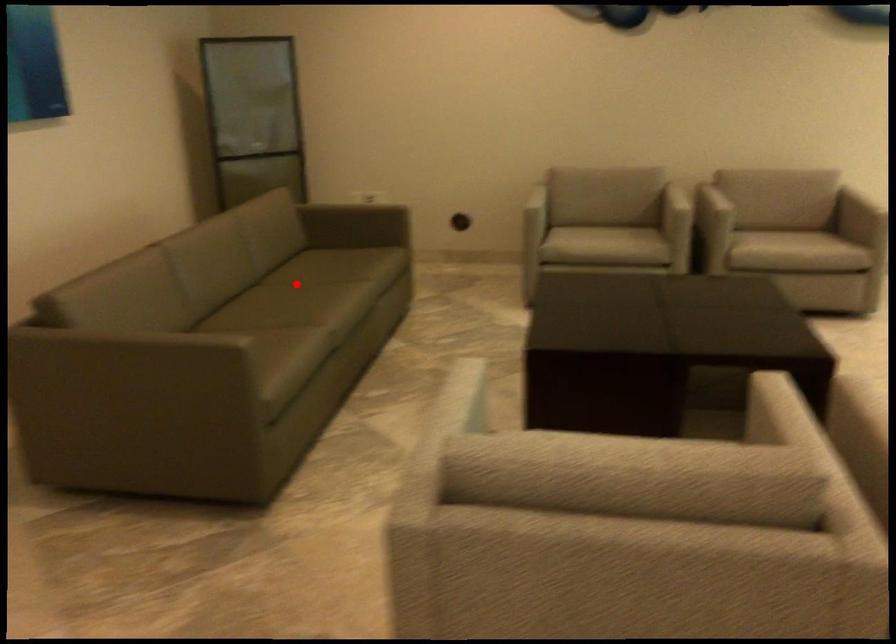
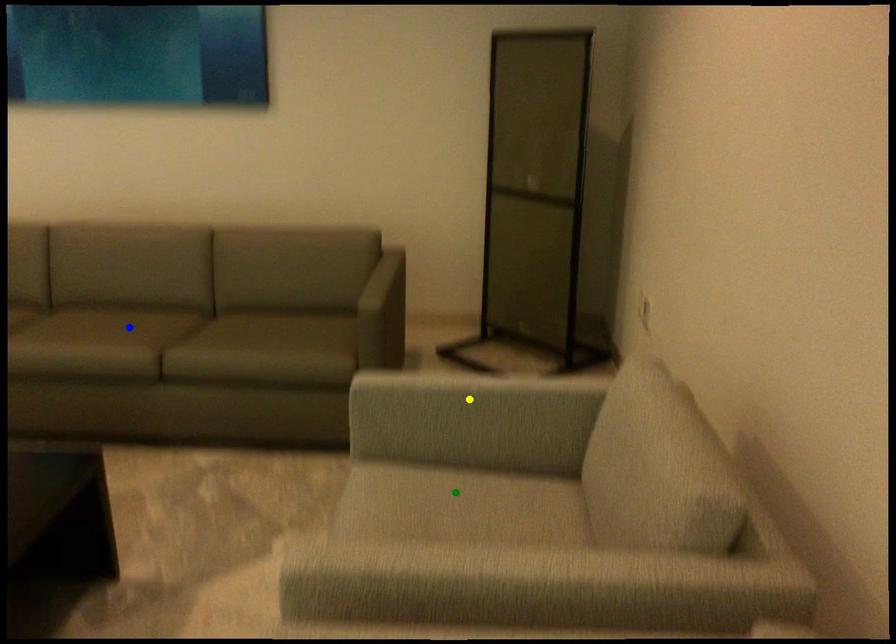
Question: I am providing you with two images of the same scene from different viewpoints. A red point is marked on the first image. You are given multiple points on the second image. Which point in image 2 represents the same 3d spot as the red point in image 1?

Choices:
 (A) green point
 (B) yellow point
 (C) blue point

Answer: (C)